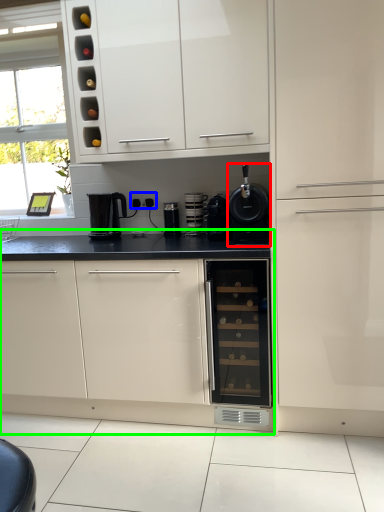
Question: Which is nearer to the kitchen appliance (highlighted by a red box)? electric outlet (highlighted by a blue box) or cabinetry (highlighted by a green box).

Choices:
 (A) electric outlet
 (B) cabinetry

Answer: (A)